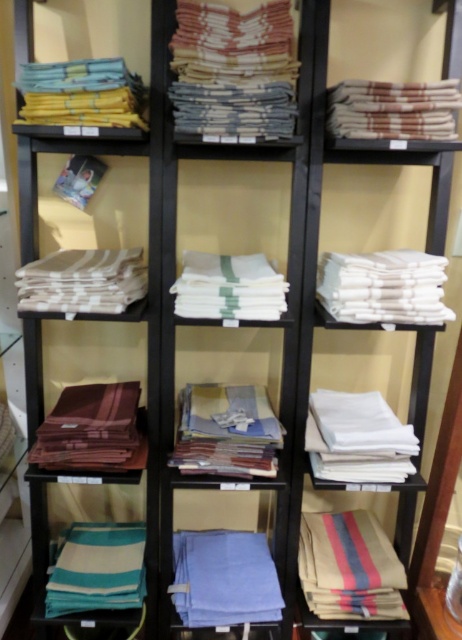
Does white cotton towel at center appear under white cotton napkin at left?

Correct, white cotton towel at center is located below white cotton napkin at left.

The image size is (462, 640). Describe the element at coordinates (358, 438) in the screenshot. I see `white cotton towel at center` at that location.

Where is `white cotton towel at center`? Image resolution: width=462 pixels, height=640 pixels. white cotton towel at center is located at coordinates (358, 438).

Which is above, striped cotton napkin at center or white cotton towel at center?

striped cotton napkin at center is higher up.

Can you confirm if striped cotton napkin at center is smaller than white cotton towel at center?

Correct, striped cotton napkin at center occupies less space than white cotton towel at center.

Find the location of a particular element. This screenshot has width=462, height=640. striped cotton napkin at center is located at coordinates (233, 68).

Is point (395, 568) less distant than point (205, 611)?

No, (395, 568) is behind (205, 611).

Can you confirm if striped cotton towel at lower center is positioned above blue cotton cloth at center?

Correct, striped cotton towel at lower center is located above blue cotton cloth at center.

Is point (376, 614) more distant than point (208, 600)?

Yes, it is behind point (208, 600).

Locate an element on the screen. This screenshot has width=462, height=640. striped cotton towel at lower center is located at coordinates (350, 566).